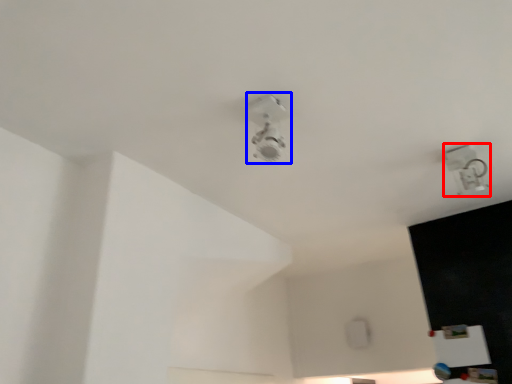
Question: Which object appears farthest to the camera in this image, lamp (highlighted by a red box) or lamp (highlighted by a blue box)?

Choices:
 (A) lamp
 (B) lamp

Answer: (A)